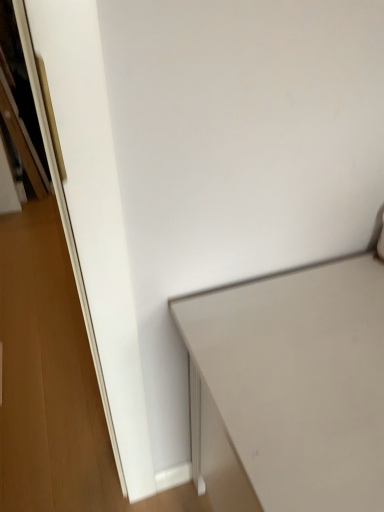
At what (x,y) coordinates should I click in order to perform the action: click on vacant area on top of matte white table at lower right (from a real-world perspective). Please return your answer as a coordinate pair (x, y). Looking at the image, I should click on (314, 346).